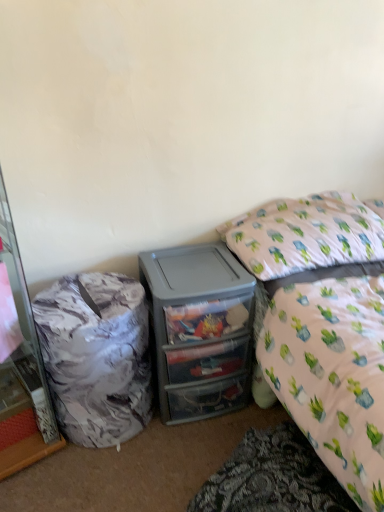
You are a GUI agent. You are given a task and a screenshot of the screen. Output one action in this format:
    pyautogui.click(x=<x>, y=<y>)
    Task: Click on the vacant area that is in front of translucent plastic drawers at center
    
    Given the screenshot: What is the action you would take?
    pyautogui.click(x=170, y=461)